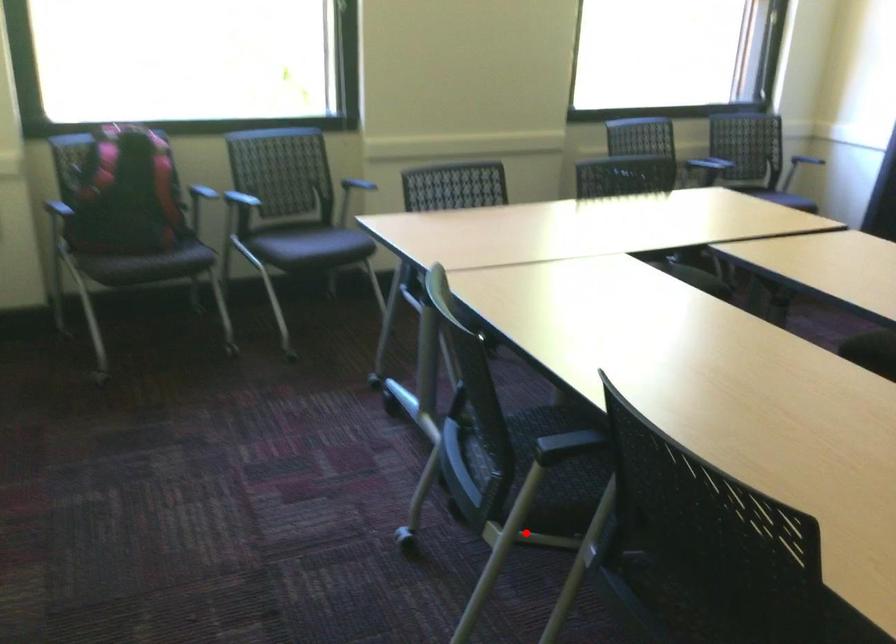
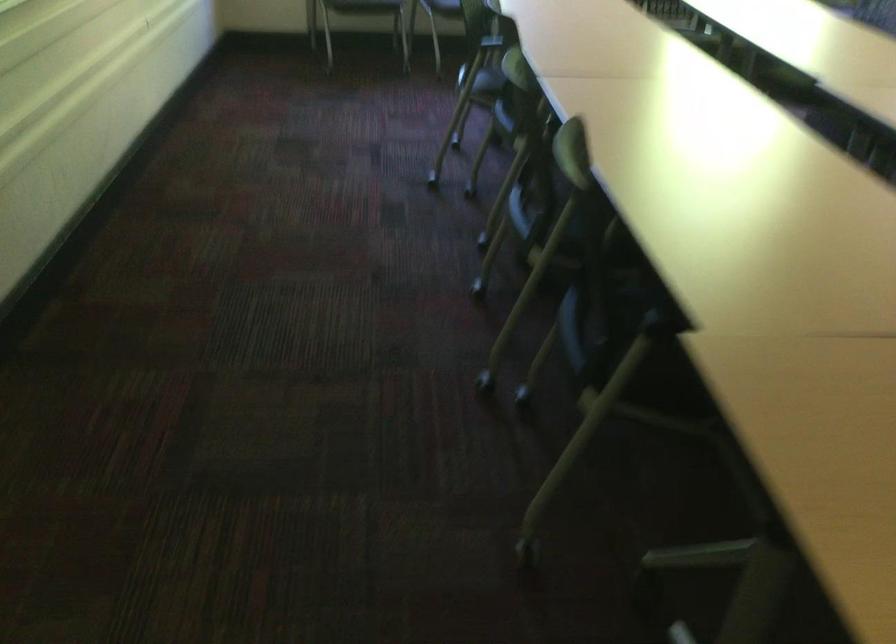
Question: I am providing you with two images of the same scene from different viewpoints. A red point is shown in image1. For the corresponding object point in image2, is it positioned nearer or farther from the camera?

Choices:
 (A) Nearer
 (B) Farther

Answer: (B)